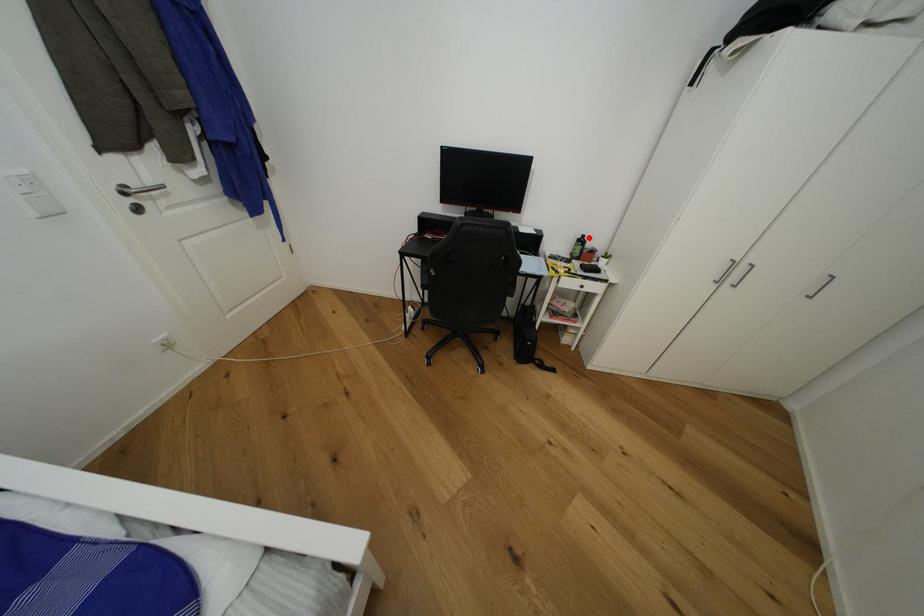
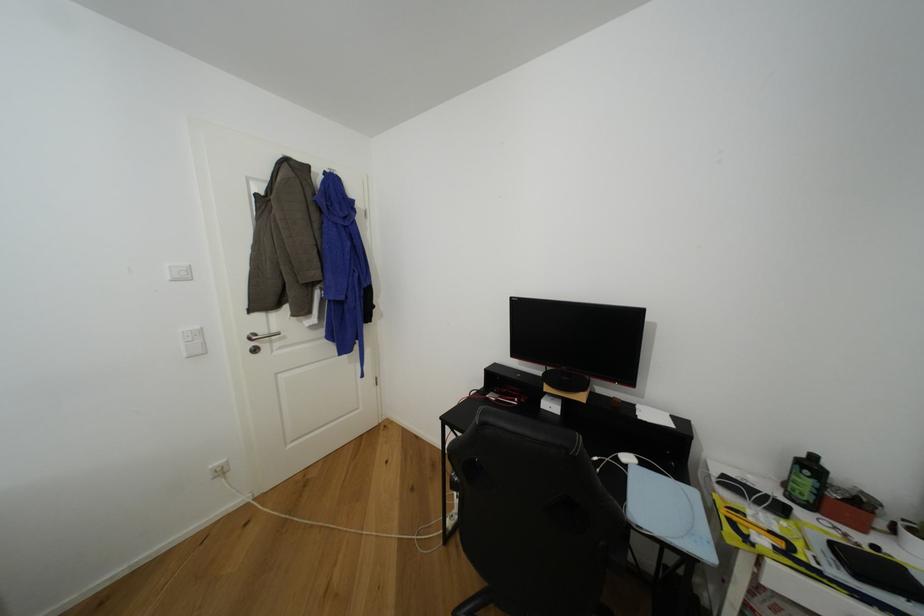
Where in the second image is the point corresponding to the highlighted location from the first image?

(820, 459)